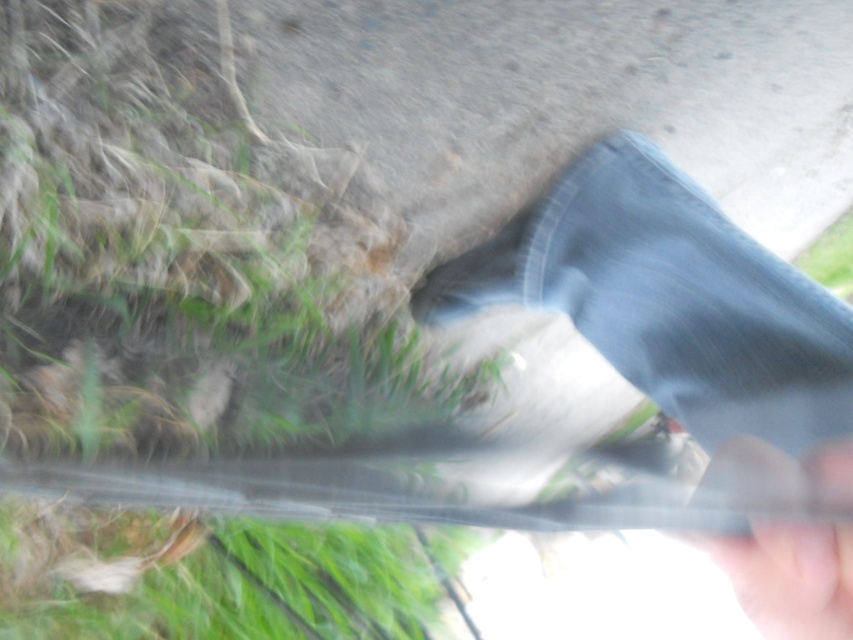
Which is more to the left, smooth skin hand at lower right or matte black shoe at lower center?

From the viewer's perspective, matte black shoe at lower center appears more on the left side.

In the scene shown: Can you confirm if smooth skin hand at lower right is bigger than matte black shoe at lower center?

No, smooth skin hand at lower right is not bigger than matte black shoe at lower center.

The height and width of the screenshot is (640, 853). Identify the location of smooth skin hand at lower right. (788, 577).

Find the location of a particular element. The image size is (853, 640). smooth skin hand at lower right is located at coordinates (788, 577).

Does green grass at lower left have a lesser width compared to smooth skin hand at lower right?

No, green grass at lower left is not thinner than smooth skin hand at lower right.

Measure the distance between green grass at lower left and smooth skin hand at lower right.

79.93 centimeters

The width and height of the screenshot is (853, 640). Describe the element at coordinates (184, 250) in the screenshot. I see `green grass at lower left` at that location.

You are a GUI agent. You are given a task and a screenshot of the screen. Output one action in this format:
    pyautogui.click(x=<x>, y=<y>)
    Task: Click on the green grass at lower left
    The image size is (853, 640).
    Given the screenshot: What is the action you would take?
    pyautogui.click(x=184, y=250)

Between green grass at lower left and denim pants at lower right, which one appears on the left side from the viewer's perspective?

From the viewer's perspective, green grass at lower left appears more on the left side.

Can you confirm if green grass at lower left is taller than denim pants at lower right?

Yes.

The image size is (853, 640). Describe the element at coordinates (184, 250) in the screenshot. I see `green grass at lower left` at that location.

Where is `green grass at lower left`? This screenshot has height=640, width=853. green grass at lower left is located at coordinates (184, 250).